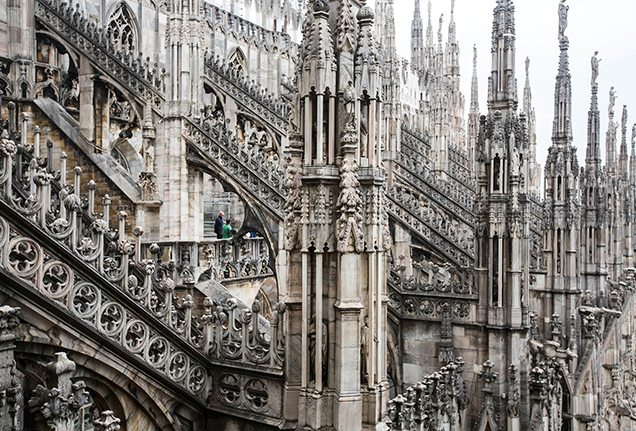
Locate an element on the screen. This screenshot has height=431, width=636. eagle statue is located at coordinates (x=69, y=364).